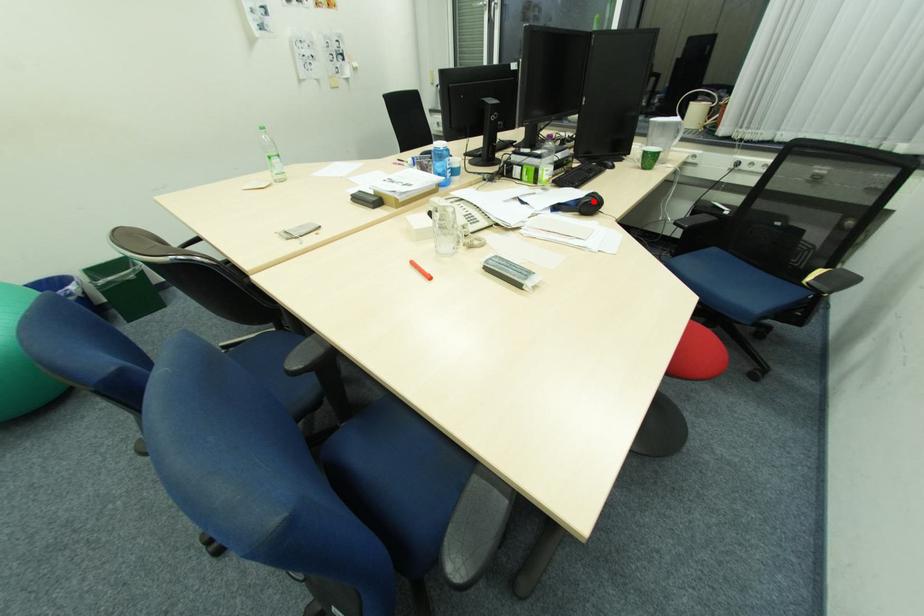
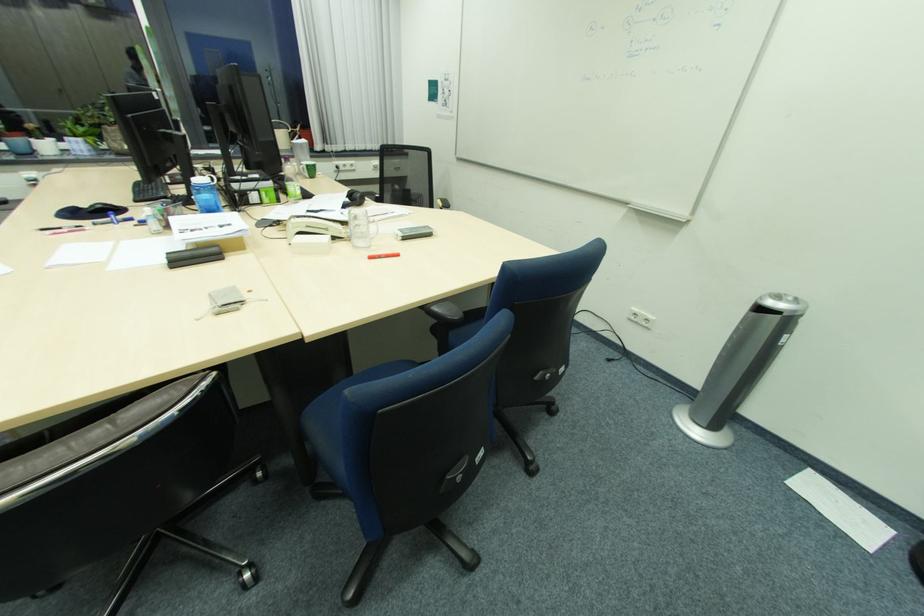
Question: I am providing you with two images of the same scene from different viewpoints. A red point is marked on the first image. Is the red point's position out of view in image 2?

Choices:
 (A) Yes
 (B) No

Answer: (B)